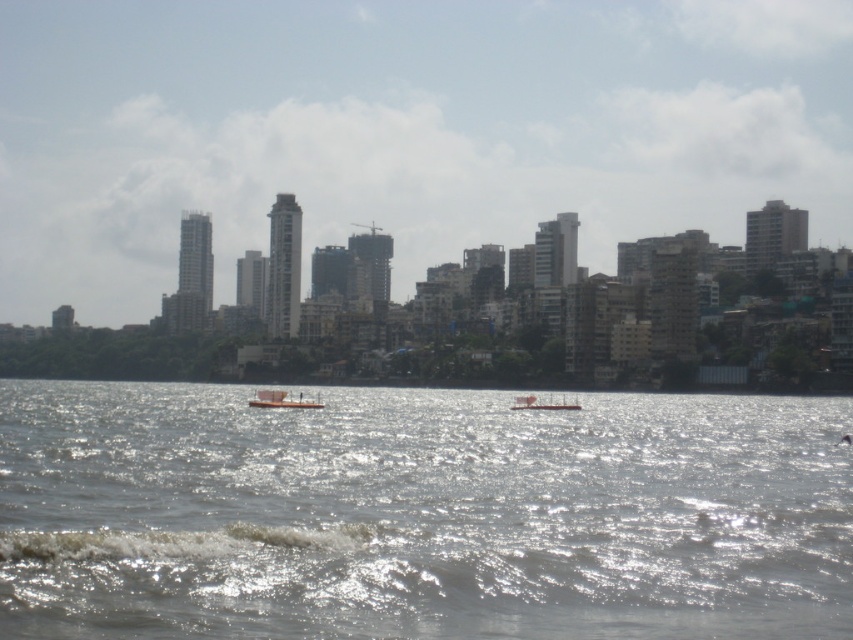
Which of these two, orange matte boat at center or white plastic boat at center, stands taller?

With more height is orange matte boat at center.

Who is positioned more to the right, orange matte boat at center or white plastic boat at center?

white plastic boat at center is more to the right.

Who is more forward, (299, 396) or (579, 404)?

Point (579, 404) is more forward.

At what (x,y) coordinates should I click in order to perform the action: click on orange matte boat at center. Please return your answer as a coordinate pair (x, y). The width and height of the screenshot is (853, 640). Looking at the image, I should click on (281, 401).

Based on the photo, who is positioned more to the right, shiny silver water at center or white plastic boat at center?

white plastic boat at center is more to the right.

How far apart are shiny silver water at center and white plastic boat at center?

They are 79.19 meters apart.

Is point (827, 625) behind point (515, 410)?

No, it is in front of (515, 410).

You are a GUI agent. You are given a task and a screenshot of the screen. Output one action in this format:
    pyautogui.click(x=<x>, y=<y>)
    Task: Click on the shiny silver water at center
    The width and height of the screenshot is (853, 640).
    Given the screenshot: What is the action you would take?
    pyautogui.click(x=421, y=515)

Who is lower down, shiny silver water at center or orange matte boat at center?

orange matte boat at center is lower down.

Is point (556, 484) positioned in front of point (270, 401)?

That is True.

Where is `shiny silver water at center`? This screenshot has height=640, width=853. shiny silver water at center is located at coordinates (421, 515).

In order to click on shiny silver water at center in this screenshot , I will do `click(421, 515)`.